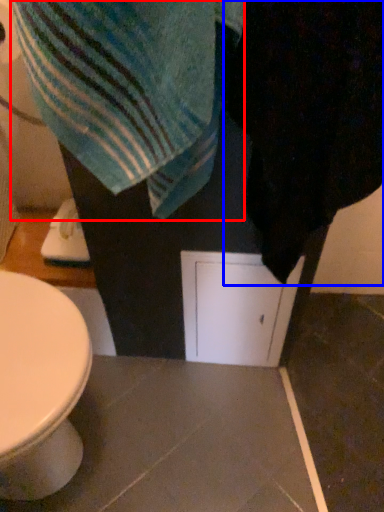
Question: Among these objects, which one is nearest to the camera, beach towel (highlighted by a red box) or bath towel (highlighted by a blue box)?

Choices:
 (A) beach towel
 (B) bath towel

Answer: (B)